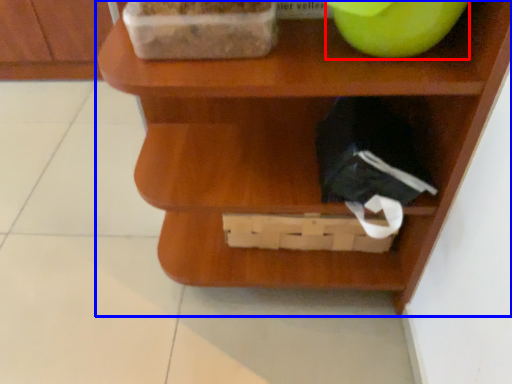
Question: Which object is closer to the camera taking this photo, apple (highlighted by a red box) or shelf (highlighted by a blue box)?

Choices:
 (A) apple
 (B) shelf

Answer: (B)